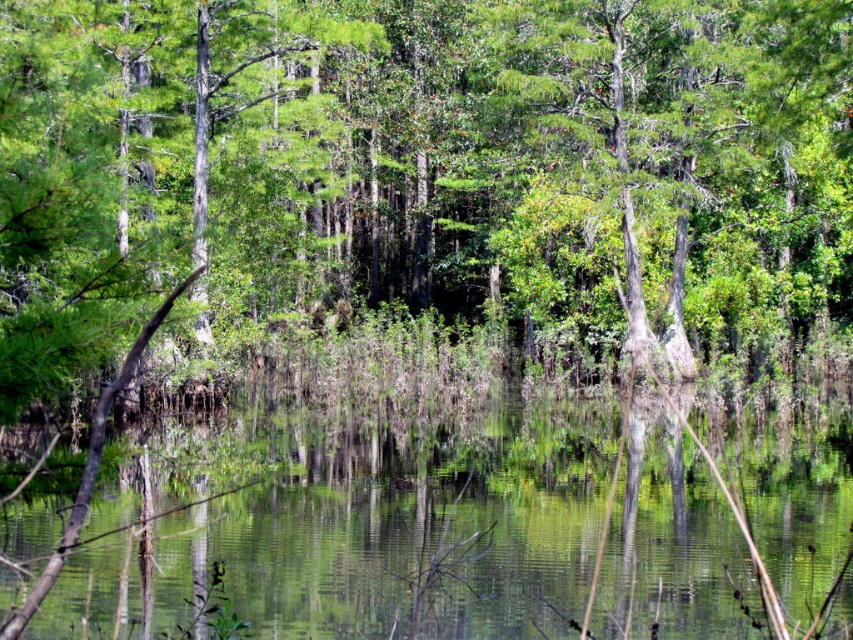
Does green matte tree at center have a larger size compared to green reflective water at center?

Indeed, green matte tree at center has a larger size compared to green reflective water at center.

Is point (811, 164) in front of point (807, 582)?

No, (811, 164) is behind (807, 582).

What are the coordinates of `green matte tree at center` in the screenshot? It's located at (424, 176).